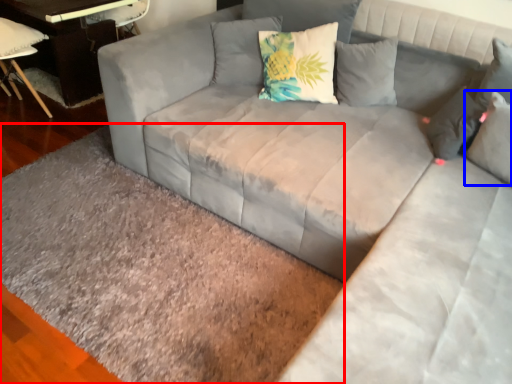
Question: Which point is closer to the camera, mat (highlighted by a red box) or pillow (highlighted by a blue box)?

Choices:
 (A) mat
 (B) pillow

Answer: (A)